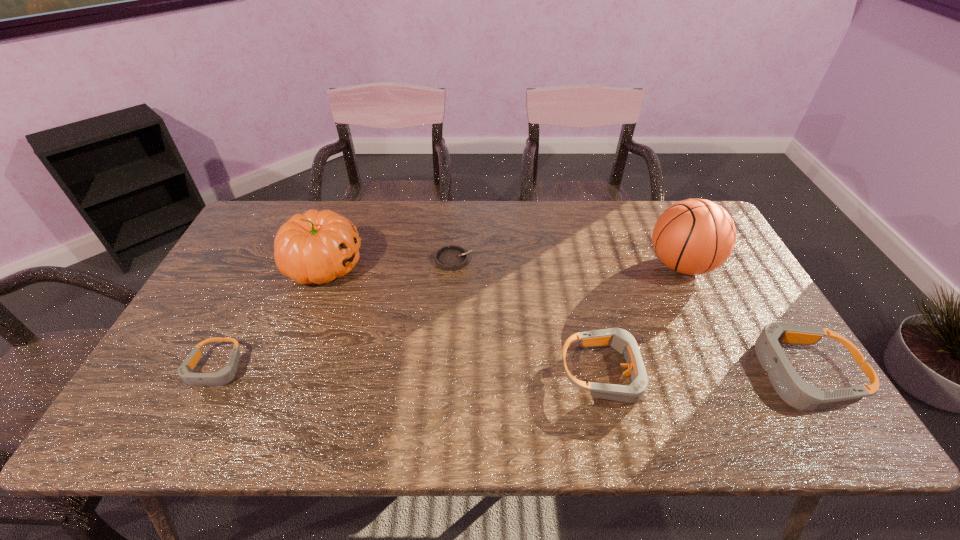
Please point a space for a new goggles to maintain equal intervals. Please provide its 2D coordinates. Your answer should be formatted as a tuple, i.e. [(x, y)], where the tuple contains the x and y coordinates of a point satisfying the conditions above.

[(410, 370)]